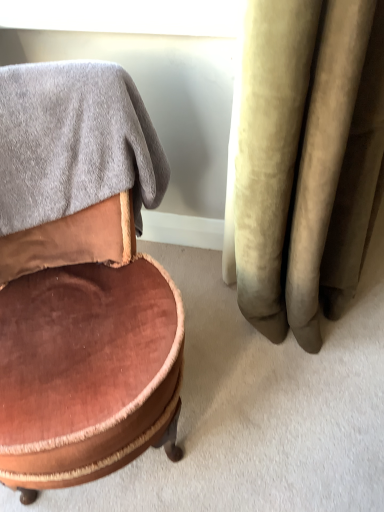
Question: From a real-world perspective, relative to gray soft towel at upper left, is velvet brown ottoman at left vertically above or below?

Choices:
 (A) above
 (B) below

Answer: (B)

Question: Is velvet brown ottoman at left taller or shorter than gray soft towel at upper left?

Choices:
 (A) short
 (B) tall

Answer: (B)

Question: Estimate the real-world distances between objects in this image. Which object is closer to the velvet brown ottoman at left?

Choices:
 (A) white glossy window screen at upper center
 (B) gray soft towel at upper left

Answer: (B)

Question: Which is farther from the velvet brown ottoman at left?

Choices:
 (A) gray soft towel at upper left
 (B) white glossy window screen at upper center

Answer: (B)